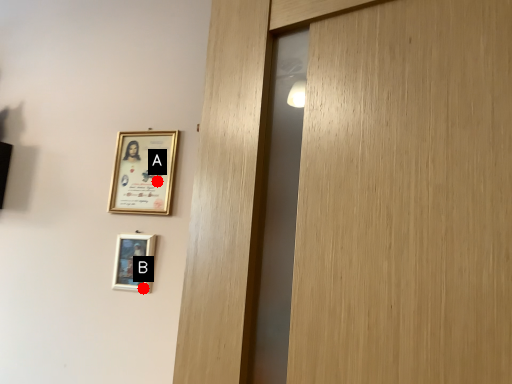
Question: Two points are circled on the image, labeled by A and B beside each circle. Which point is further to the camera?

Choices:
 (A) A is further
 (B) B is further

Answer: (A)